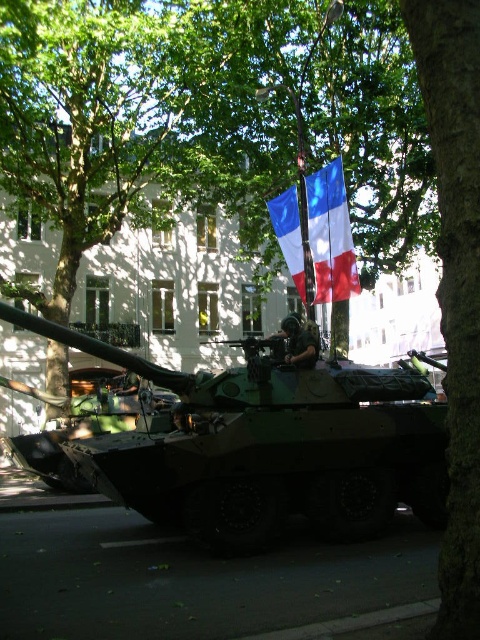
Which is more to the right, camouflage fabric tank at center or green rough bark tree at center?

Positioned to the right is green rough bark tree at center.

Does camouflage fabric tank at center have a smaller size compared to green rough bark tree at center?

Actually, camouflage fabric tank at center might be larger than green rough bark tree at center.

Does point (255, 509) come in front of point (450, 369)?

No, it is behind (450, 369).

You are a GUI agent. You are given a task and a screenshot of the screen. Output one action in this format:
    pyautogui.click(x=<x>, y=<y>)
    Task: Click on the camouflage fabric tank at center
    Image resolution: width=480 pixels, height=640 pixels.
    Given the screenshot: What is the action you would take?
    pyautogui.click(x=269, y=445)

What do you see at coordinates (269, 445) in the screenshot? This screenshot has width=480, height=640. I see `camouflage fabric tank at center` at bounding box center [269, 445].

Between point (255, 476) and point (296, 228), which one is positioned in front?

Point (255, 476) is more forward.

At what (x,y) coordinates should I click in order to perform the action: click on camouflage fabric tank at center. Please return your answer as a coordinate pair (x, y). This screenshot has width=480, height=640. Looking at the image, I should click on (269, 445).

Between green rough bark tree at center and blue fabric flag at center, which one appears on the right side from the viewer's perspective?

blue fabric flag at center

Can you confirm if green rough bark tree at center is wider than blue fabric flag at center?

In fact, green rough bark tree at center might be narrower than blue fabric flag at center.

This screenshot has height=640, width=480. Identify the location of green rough bark tree at center. (456, 280).